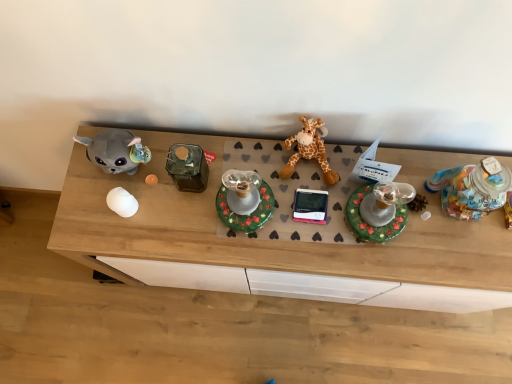
The height and width of the screenshot is (384, 512). I want to click on vacant area that lies between white glossy egg at center, acting as the 4th toy starting from the right, and green matte candle holder at center, which is the third toy from right to left, so click(x=181, y=211).